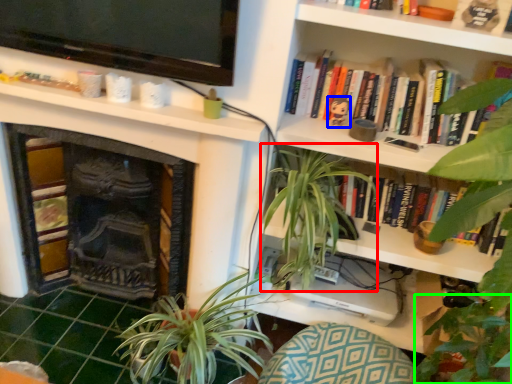
Question: Which object is positioned farthest from vegetation (highlighted by a red box)? Select from toy (highlighted by a blue box) and vegetation (highlighted by a green box).

Choices:
 (A) toy
 (B) vegetation

Answer: (B)